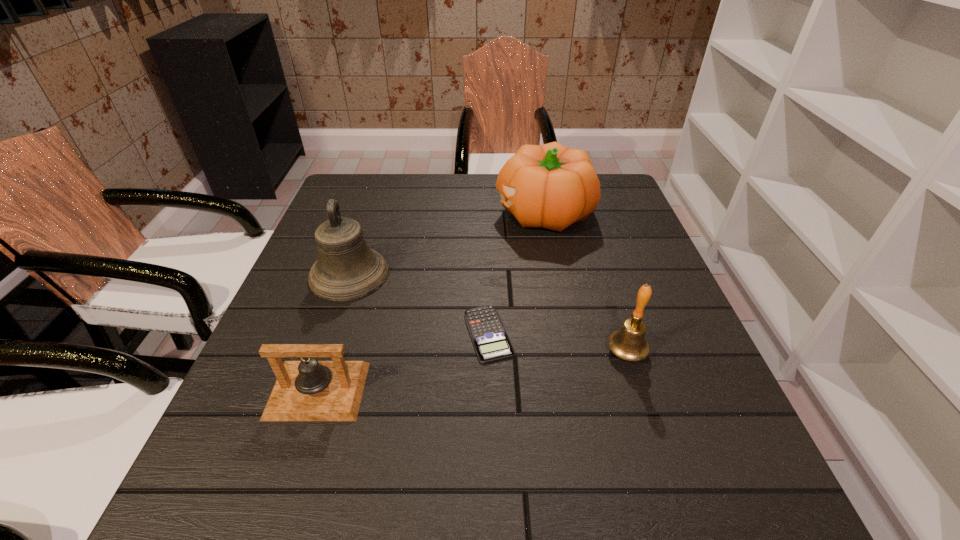
The width and height of the screenshot is (960, 540). In order to click on unoccupied area between the farthest object and the rightmost bell in this screenshot , I will do `click(585, 282)`.

Locate an element on the screen. free area in between the pumpkin and the shortest object is located at coordinates (516, 273).

Locate an element on the screen. This screenshot has height=540, width=960. free space between the pumpkin and the rightmost bell is located at coordinates (585, 282).

Where is `free space between the calculator and the rightmost bell`? The width and height of the screenshot is (960, 540). free space between the calculator and the rightmost bell is located at coordinates (558, 343).

The width and height of the screenshot is (960, 540). In order to click on vacant area between the calculator and the shortest bell in this screenshot , I will do `click(403, 362)`.

Find the location of a particular element. free space that is in between the calculator and the shortest bell is located at coordinates (403, 362).

Identify the location of free space between the rightmost bell and the pumpkin. (585, 282).

Where is `vacant space that is in between the second farthest object and the fourth tallest object`? vacant space that is in between the second farthest object and the fourth tallest object is located at coordinates (333, 333).

Where is `vacant area that lies between the shortest object and the pumpkin`? vacant area that lies between the shortest object and the pumpkin is located at coordinates (516, 273).

Locate an element on the screen. free space between the farthest bell and the shortest bell is located at coordinates (333, 333).